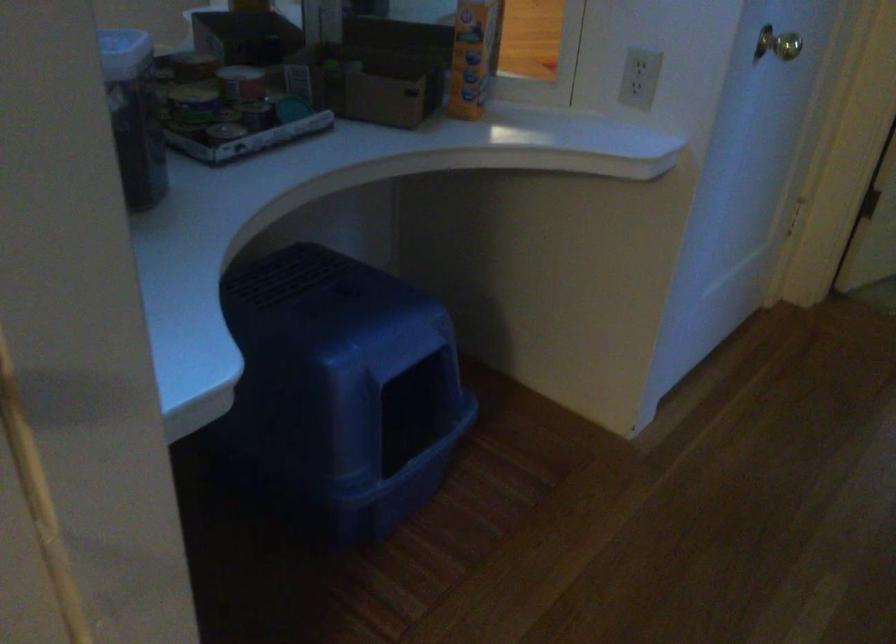
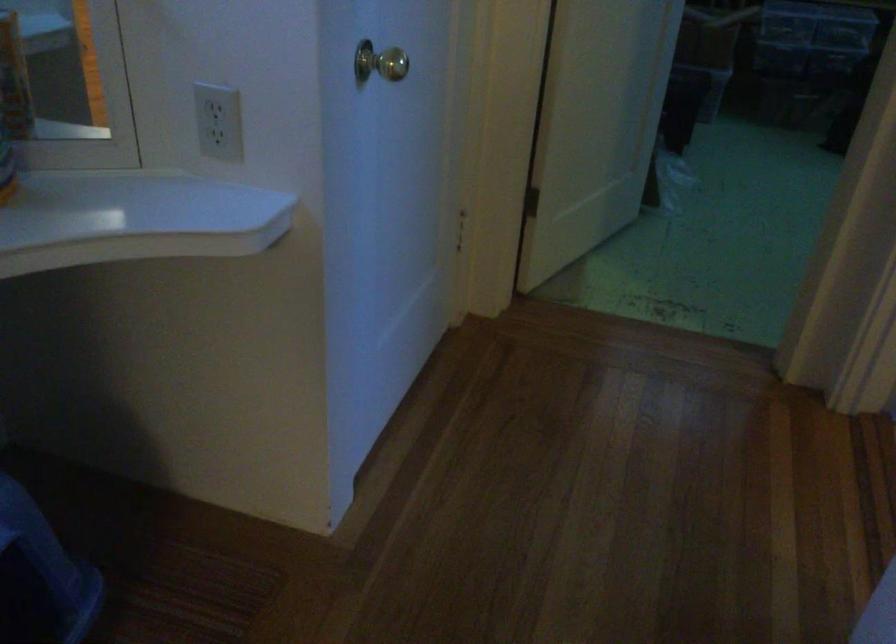
What movement of the cameraman would produce the second image?

The cameraman moved toward right, forward.